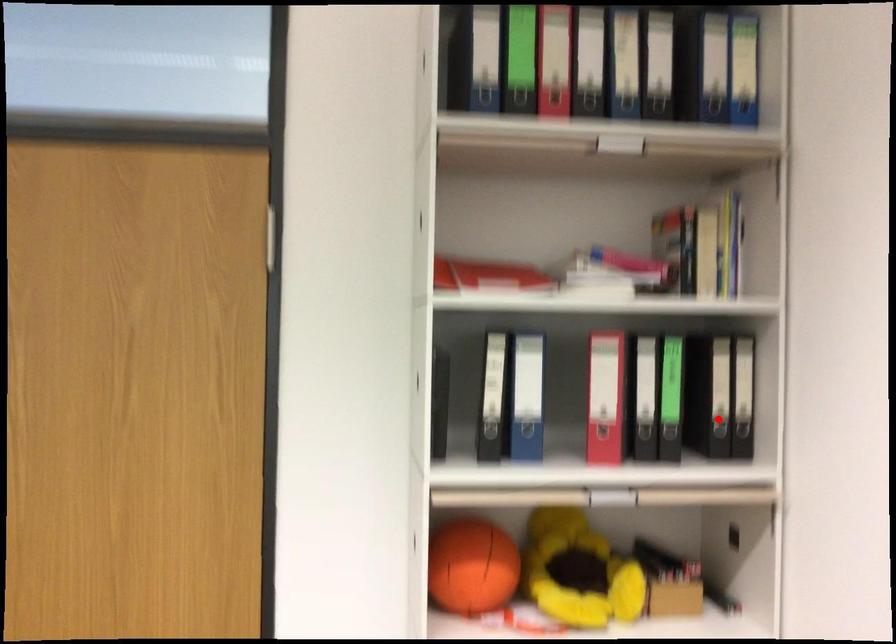
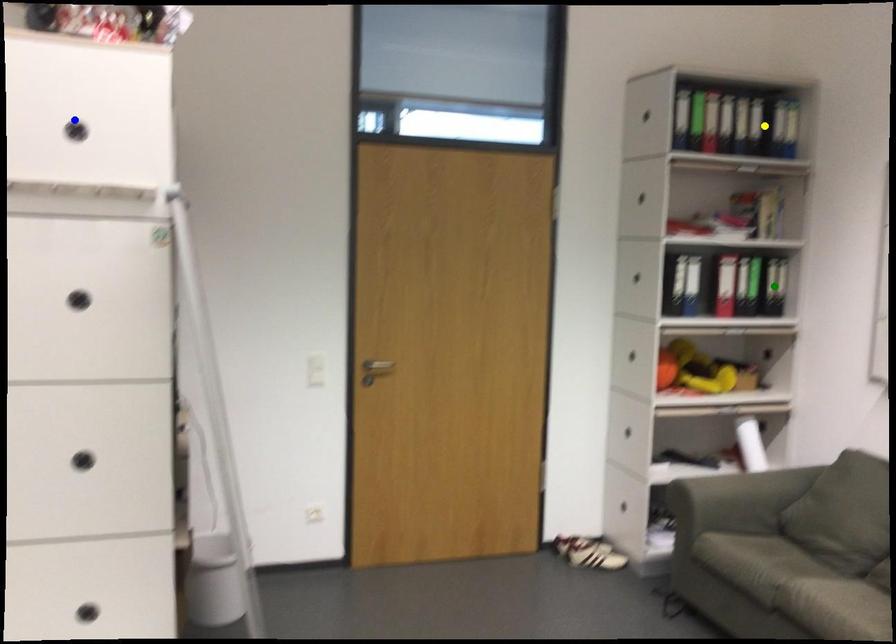
Question: I am providing you with two images of the same scene from different viewpoints. A red point is marked on the first image. You are given multiple points on the second image. In image 2, which mark is for the same physical point as the one in image 1?

Choices:
 (A) yellow point
 (B) blue point
 (C) green point

Answer: (C)